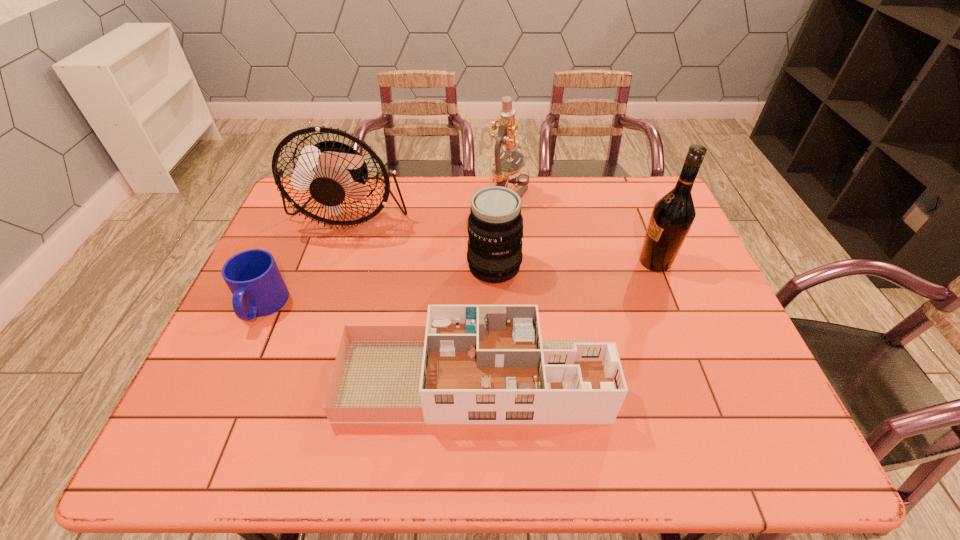
Where is `vacant space that is in between the rightmost object and the nearest object`? The height and width of the screenshot is (540, 960). vacant space that is in between the rightmost object and the nearest object is located at coordinates (564, 321).

Find the location of `free space between the dollhouse and the fan`. free space between the dollhouse and the fan is located at coordinates (412, 295).

You are a GUI agent. You are given a task and a screenshot of the screen. Output one action in this format:
    pyautogui.click(x=<x>, y=<y>)
    Task: Click on the vacant space in between the microscope and the mug
    This screenshot has height=540, width=960.
    Given the screenshot: What is the action you would take?
    pyautogui.click(x=386, y=251)

Where is `free spot between the fan and the nearest object`? Image resolution: width=960 pixels, height=540 pixels. free spot between the fan and the nearest object is located at coordinates click(412, 295).

Where is `vacant area that lies between the fan and the telephoto lens`? The height and width of the screenshot is (540, 960). vacant area that lies between the fan and the telephoto lens is located at coordinates (422, 239).

In order to click on vacant space that is in between the microscope and the fan in this screenshot , I will do `click(430, 204)`.

Find the location of a particular element. The height and width of the screenshot is (540, 960). vacant region between the rightmost object and the microscope is located at coordinates (582, 228).

Identify the location of object that ranks as the third closest to the fan. (504, 172).

Point out which object is positioned as the nearest to the mug. Please provide its 2D coordinates. Your answer should be formatted as a tuple, i.e. [(x, y)], where the tuple contains the x and y coordinates of a point satisfying the conditions above.

[(330, 170)]

What are the coordinates of `free location that satisfies the following two spatial constraints: 1. on the label of the rightmost object; 2. on the side with the handle of the mug` in the screenshot? It's located at (673, 307).